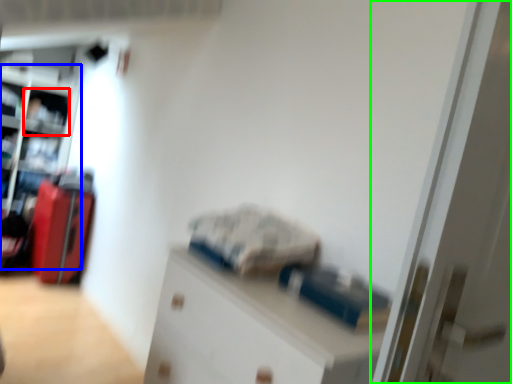
Question: Which is nearer to the shelf (highlighted by a red box)? bookshelf (highlighted by a blue box) or door (highlighted by a green box).

Choices:
 (A) bookshelf
 (B) door

Answer: (A)